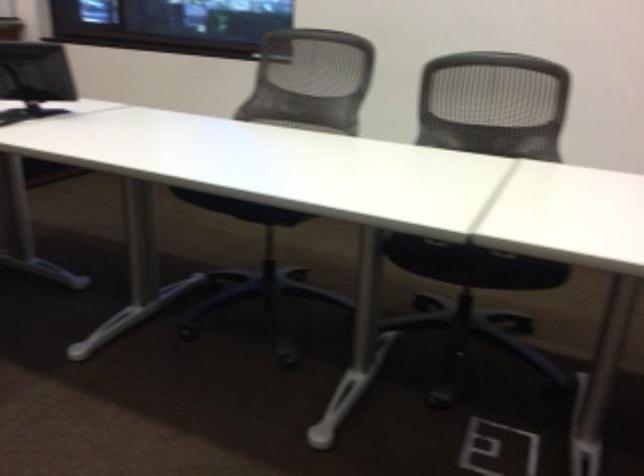
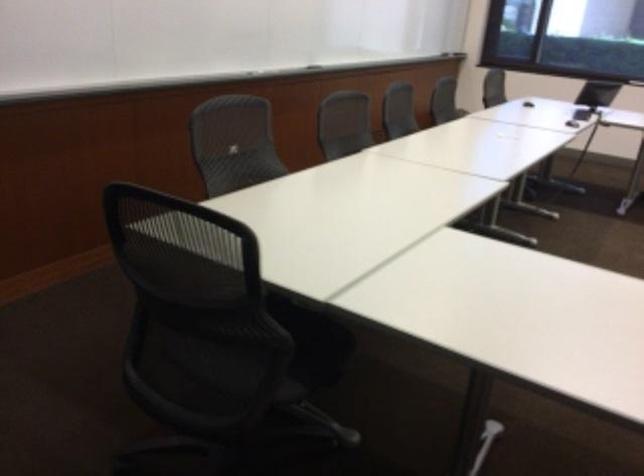
Which direction would the cameraman need to move to produce the second image?

The movement direction of the cameraman is left, backward.